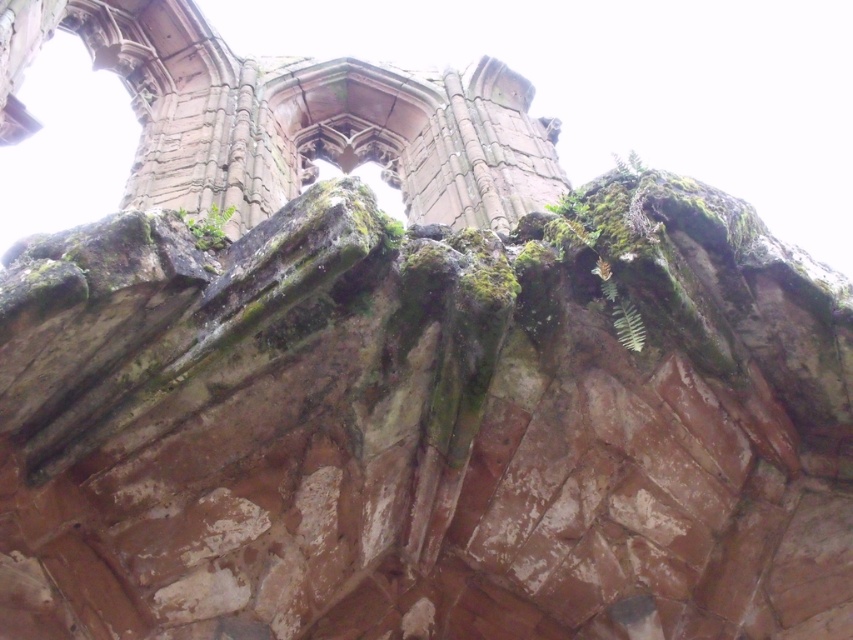
You are standing below the ancient stone structure and notice the green leafy plant at upper center. Based on its position, can you determine if it is closer to the top of the structure or the base?

The green leafy plant at upper center is located at point (619, 308), which is closer to the top of the structure since the coordinates suggest it is positioned higher up.

You are a drone operator trying to capture a photo of the green leafy plant at upper center. The drone has a maximum flight distance of 60 meters. Can you safely fly the drone from your current position to the plant without exceeding the distance limit?

The distance between the drone and the green leafy plant at upper center is 64.10 meters, which exceeds the drone maximum flight distance of 60 meters. Therefore, the drone cannot safely reach the plant without exceeding the distance limit.

You are a botanist examining the ancient stone structure. You notice two green elements at the upper center of the structure. Which one is wider between the green leafy plant at upper center and the green mossy rock at upper center?

The green mossy rock at upper center is wider than the green leafy plant at upper center, as the leafy plant has a smaller width compared to the mossy rock.